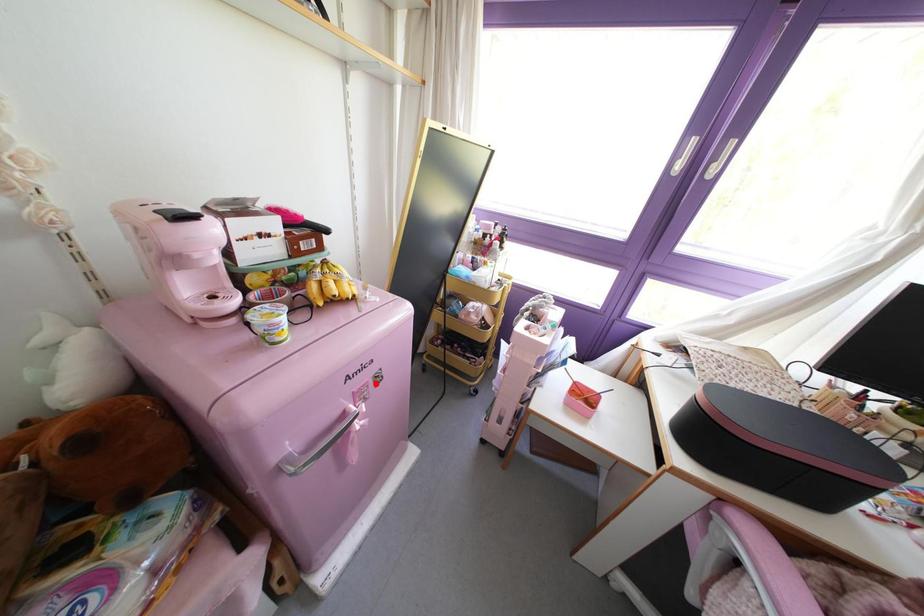
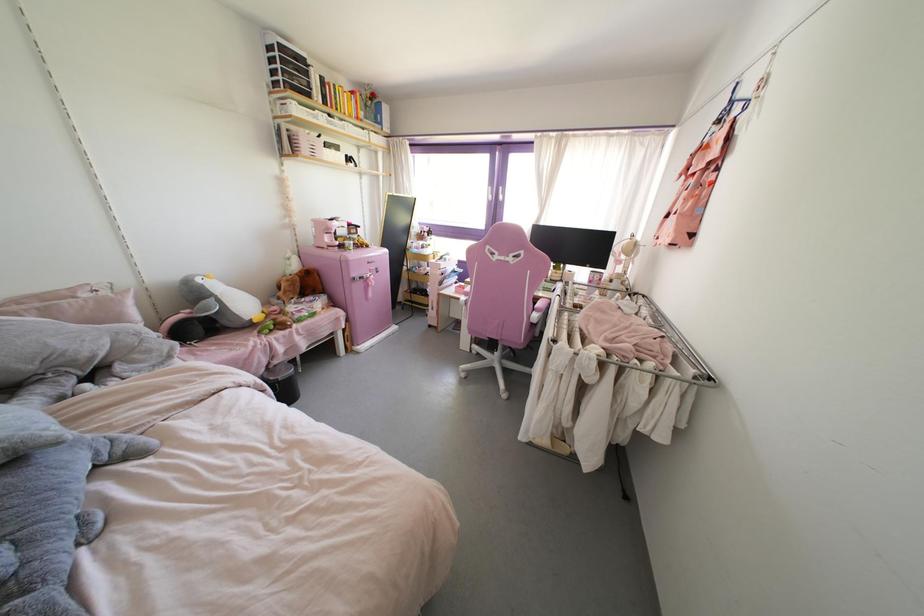
Where in the second image is the point corresponding to the highlighted location from the first image?

(377, 272)